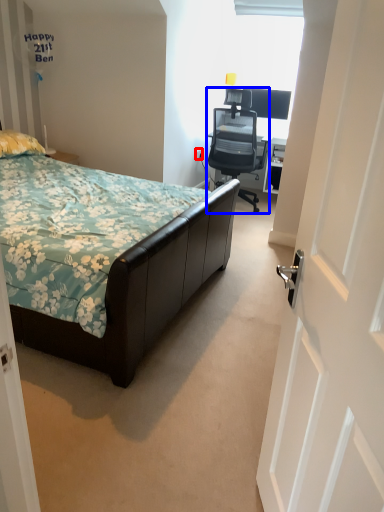
Question: Which point is further to the camera, power outlet (highlighted by a red box) or chair (highlighted by a blue box)?

Choices:
 (A) power outlet
 (B) chair

Answer: (A)